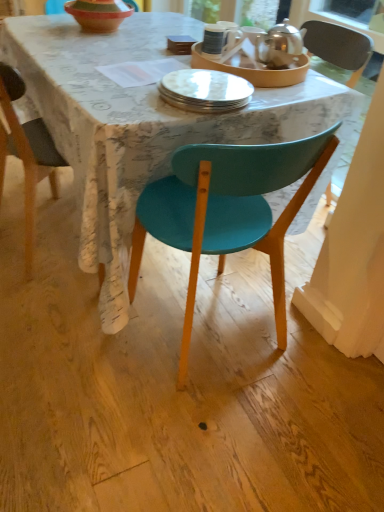
Identify the location of vacant area that is situated to the right of teal plastic chair at center. This screenshot has width=384, height=512. (316, 364).